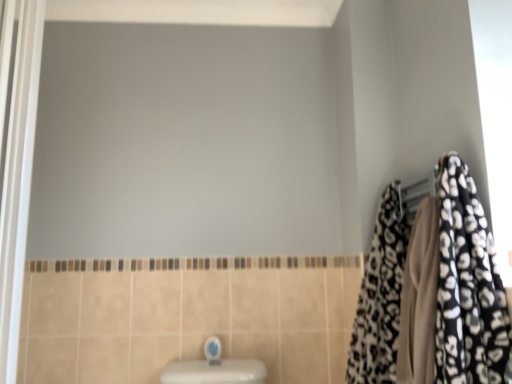
Question: Considering the relative positions of leopard print towel at right and blue glossy faucet at lower center in the image provided, is leopard print towel at right to the left or to the right of blue glossy faucet at lower center?

Choices:
 (A) right
 (B) left

Answer: (A)

Question: Is point (351, 367) closer or farther from the camera than point (214, 336)?

Choices:
 (A) closer
 (B) farther

Answer: (A)

Question: Estimate the real-world distances between objects in this image. Which object is farther from the leopard print fabric at right?

Choices:
 (A) leopard print towel at right
 (B) blue glossy faucet at lower center
 (C) white glossy screen door at left

Answer: (C)

Question: Based on their relative distances, which object is farther from the blue glossy faucet at lower center?

Choices:
 (A) white glossy screen door at left
 (B) leopard print towel at right
 (C) leopard print fabric at right

Answer: (A)